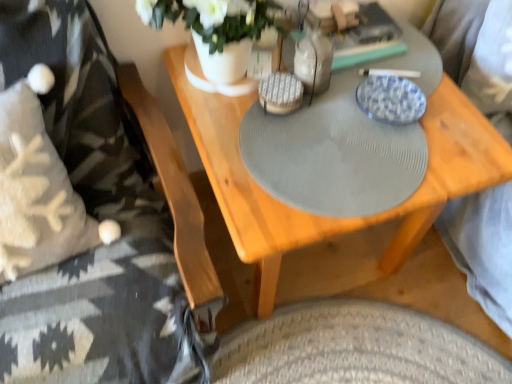
Question: From a real-world perspective, is white matte vase at upper center located beneath blue glazed plate at upper center?

Choices:
 (A) no
 (B) yes

Answer: (A)

Question: Can you confirm if white matte vase at upper center is taller than blue glazed plate at upper center?

Choices:
 (A) no
 (B) yes

Answer: (B)

Question: Does white matte vase at upper center have a larger size compared to blue glazed plate at upper center?

Choices:
 (A) yes
 (B) no

Answer: (A)

Question: From the image's perspective, would you say white matte vase at upper center is positioned over blue glazed plate at upper center?

Choices:
 (A) yes
 (B) no

Answer: (A)

Question: Does white matte vase at upper center come behind blue glazed plate at upper center?

Choices:
 (A) yes
 (B) no

Answer: (B)

Question: Would you say white matte vase at upper center is to the left or to the right of knitted wool blanket at left in the picture?

Choices:
 (A) left
 (B) right

Answer: (B)

Question: In terms of height, does white matte vase at upper center look taller or shorter compared to knitted wool blanket at left?

Choices:
 (A) short
 (B) tall

Answer: (A)

Question: From a real-world perspective, is white matte vase at upper center positioned above or below knitted wool blanket at left?

Choices:
 (A) below
 (B) above

Answer: (B)

Question: Would you say white matte vase at upper center is inside or outside knitted wool blanket at left?

Choices:
 (A) outside
 (B) inside

Answer: (A)

Question: Do you think blue glazed plate at upper center is within white matte vase at upper center, or outside of it?

Choices:
 (A) outside
 (B) inside

Answer: (A)

Question: Relative to white matte vase at upper center, is blue glazed plate at upper center in front or behind?

Choices:
 (A) front
 (B) behind

Answer: (B)

Question: From the image's perspective, relative to white matte vase at upper center, is blue glazed plate at upper center above or below?

Choices:
 (A) below
 (B) above

Answer: (A)

Question: In terms of width, does blue glazed plate at upper center look wider or thinner when compared to white matte vase at upper center?

Choices:
 (A) thin
 (B) wide

Answer: (A)

Question: Considering the relative positions of wooden table at center and clear glass bottle at center in the image provided, is wooden table at center to the left or to the right of clear glass bottle at center?

Choices:
 (A) right
 (B) left

Answer: (A)

Question: From the image's perspective, is wooden table at center positioned above or below clear glass bottle at center?

Choices:
 (A) above
 (B) below

Answer: (B)